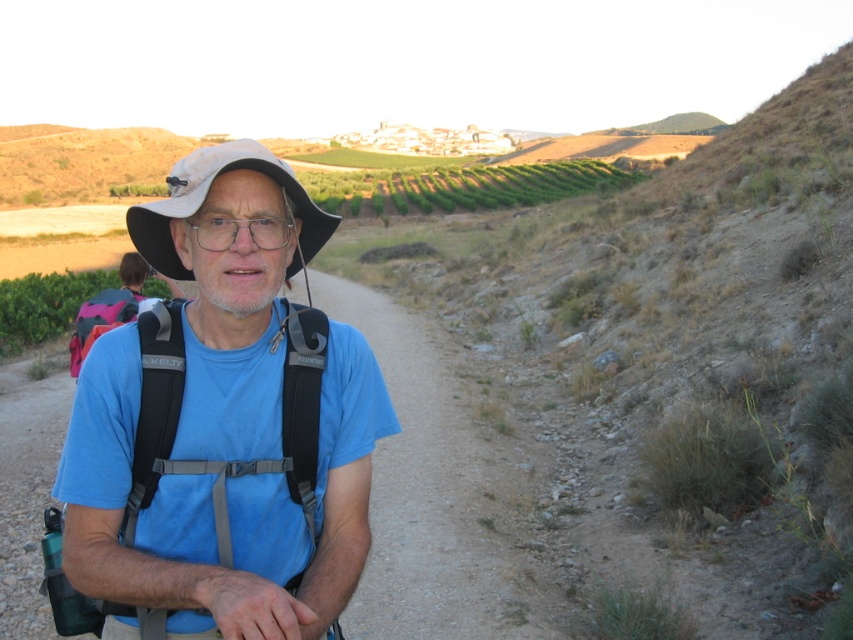
Question: Which point is closer to the camera?

Choices:
 (A) click(x=207, y=598)
 (B) click(x=289, y=220)

Answer: (A)

Question: Does blue fabric shirt at center have a smaller size compared to white fabric hat at center?

Choices:
 (A) yes
 (B) no

Answer: (B)

Question: Which point is closer to the camera taking this photo?

Choices:
 (A) (280, 221)
 (B) (286, 188)

Answer: (A)

Question: Does white fabric hat at center have a lesser width compared to transparent plastic glasses at center?

Choices:
 (A) no
 (B) yes

Answer: (A)

Question: Which object is positioned farthest from the transparent plastic glasses at center?

Choices:
 (A) white fabric hat at center
 (B) blue fabric shirt at center

Answer: (B)

Question: In this image, where is blue fabric shirt at center located relative to white fabric hat at center?

Choices:
 (A) below
 (B) above

Answer: (A)